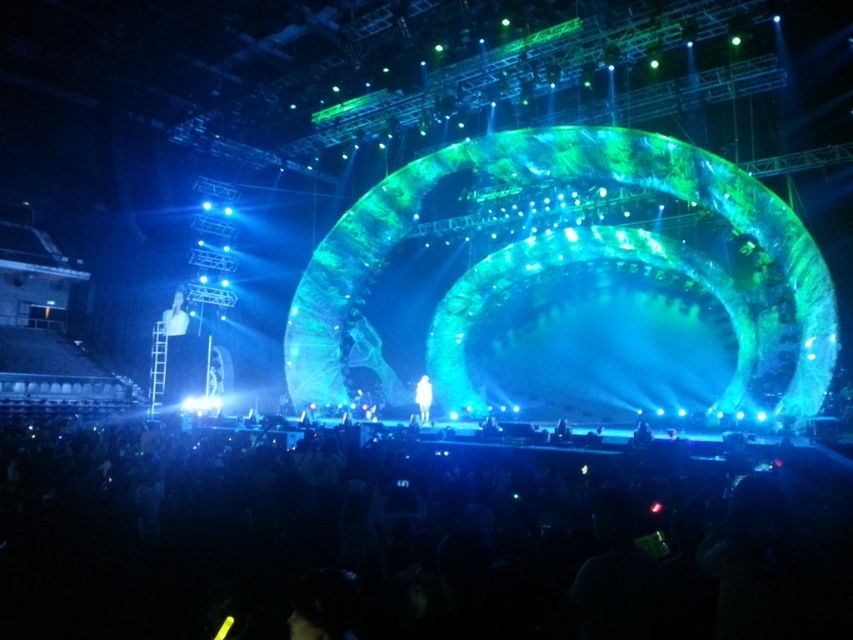
Question: Observing the image, what is the correct spatial positioning of black matte crowd at lower center in reference to translucent white figure at center?

Choices:
 (A) above
 (B) below

Answer: (B)

Question: Does white glossy figure at upper left appear under translucent white figure at center?

Choices:
 (A) no
 (B) yes

Answer: (A)

Question: Which object is positioned closest to the translucent white figure at center?

Choices:
 (A) black matte crowd at lower center
 (B) white glossy figure at upper left

Answer: (B)

Question: Estimate the real-world distances between objects in this image. Which object is closer to the translucent white figure at center?

Choices:
 (A) black matte crowd at lower center
 (B) white glossy figure at upper left

Answer: (B)

Question: Which of the following is the farthest from the observer?

Choices:
 (A) (422, 412)
 (B) (183, 328)
 (C) (730, 592)

Answer: (B)

Question: Can you confirm if black matte crowd at lower center is positioned to the right of white glossy figure at upper left?

Choices:
 (A) no
 (B) yes

Answer: (B)